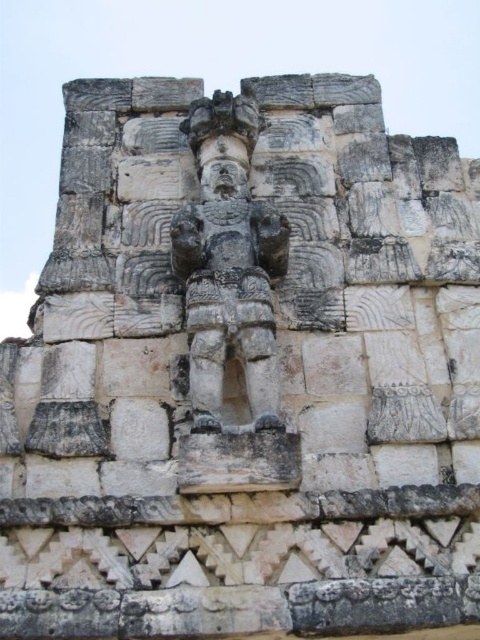
You are an archaeologist examining the ancient stone structure. You notice the gray stone figure at center and the matte stone face at center. Which object is taller?

The gray stone figure at center is much taller than the matte stone face at center.

You are an archaeologist examining the ancient stone structure. You notice two points on the carved figure. The first point is at coordinates point (x=180, y=221) and the second is at point (x=225, y=177). Which of these points is nearer to you as you observe the structure?

Point (x=180, y=221) is closer to the viewer than point (x=225, y=177) according to the description.